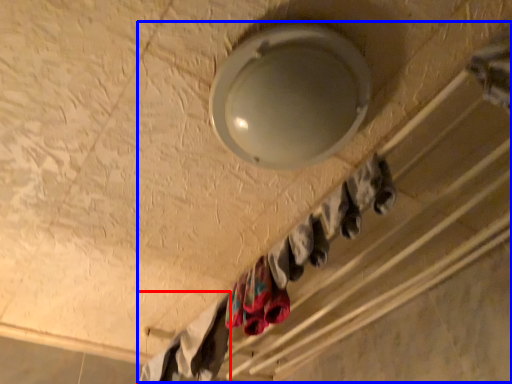
Question: Among these objects, which one is farthest to the camera, clothing (highlighted by a red box) or closet (highlighted by a blue box)?

Choices:
 (A) clothing
 (B) closet

Answer: (A)